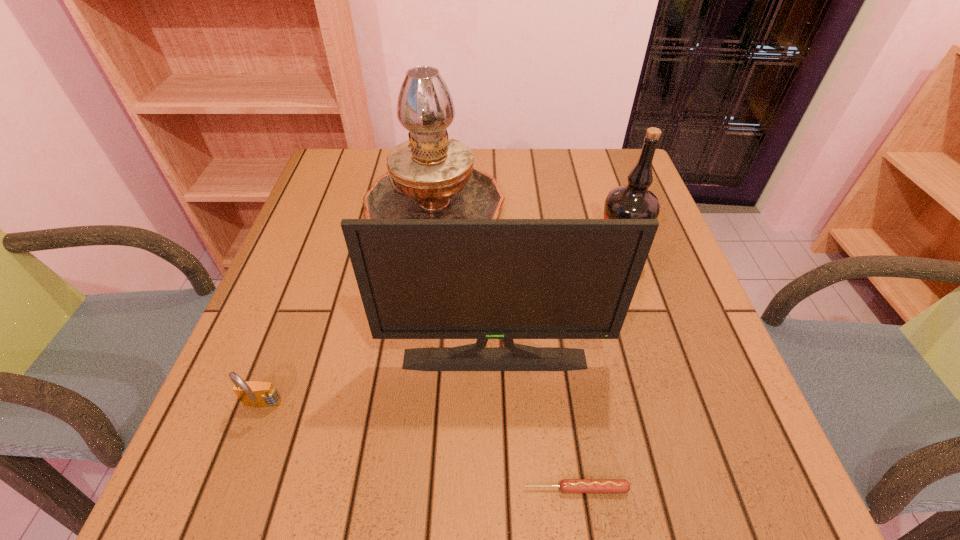
I want to click on vacant space located 0.140m on the side with the combination dials of the padlock, so click(x=225, y=510).

Image resolution: width=960 pixels, height=540 pixels. I want to click on vacant area situated on the left of the shortest object, so click(x=370, y=489).

The width and height of the screenshot is (960, 540). Identify the location of object that is at the far edge. (431, 176).

I want to click on object present at the near edge, so coord(566,485).

Find the location of `oil lamp present at the left edge`. oil lamp present at the left edge is located at coordinates (431, 176).

This screenshot has width=960, height=540. Find the location of `padlock at the left edge`. padlock at the left edge is located at coordinates (251, 393).

Locate an element on the screen. This screenshot has width=960, height=540. object situated at the right edge is located at coordinates (632, 201).

Locate an element on the screen. This screenshot has width=960, height=540. object that is at the far left corner is located at coordinates (431, 176).

In the image, there is a desktop. Where is `free space at the far edge`? free space at the far edge is located at coordinates (492, 148).

Identify the location of blank space at the left edge of the desktop. (276, 438).